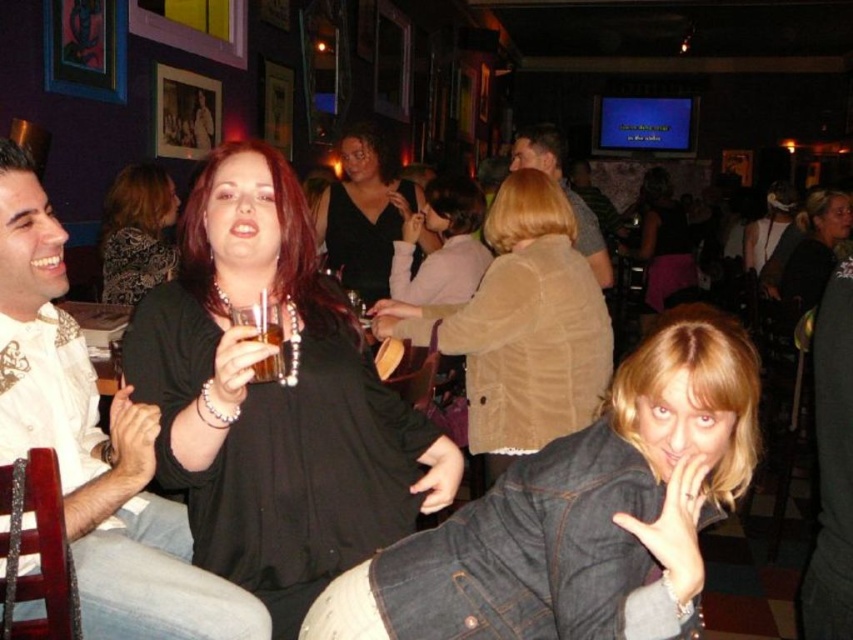
Does black velvet dress at center have a larger size compared to translucent glass at center?

Indeed, black velvet dress at center has a larger size compared to translucent glass at center.

Is black velvet dress at center to the left of translucent glass at center from the viewer's perspective?

Yes, black velvet dress at center is to the left of translucent glass at center.

What do you see at coordinates (364, 212) in the screenshot? This screenshot has height=640, width=853. I see `black velvet dress at center` at bounding box center [364, 212].

Where is `black velvet dress at center`? black velvet dress at center is located at coordinates (364, 212).

Does point (258, 232) come behind point (688, 282)?

That is False.

Is black matte shirt at center bigger than matte black dress at center?

Actually, black matte shirt at center might be smaller than matte black dress at center.

Describe the element at coordinates (274, 400) in the screenshot. I see `black matte shirt at center` at that location.

Find the location of a particular element. This screenshot has width=853, height=640. black matte shirt at center is located at coordinates (274, 400).

Can you confirm if black matte shirt at center is smaller than suede jacket at center?

Yes.

Where is `black matte shirt at center`? black matte shirt at center is located at coordinates (274, 400).